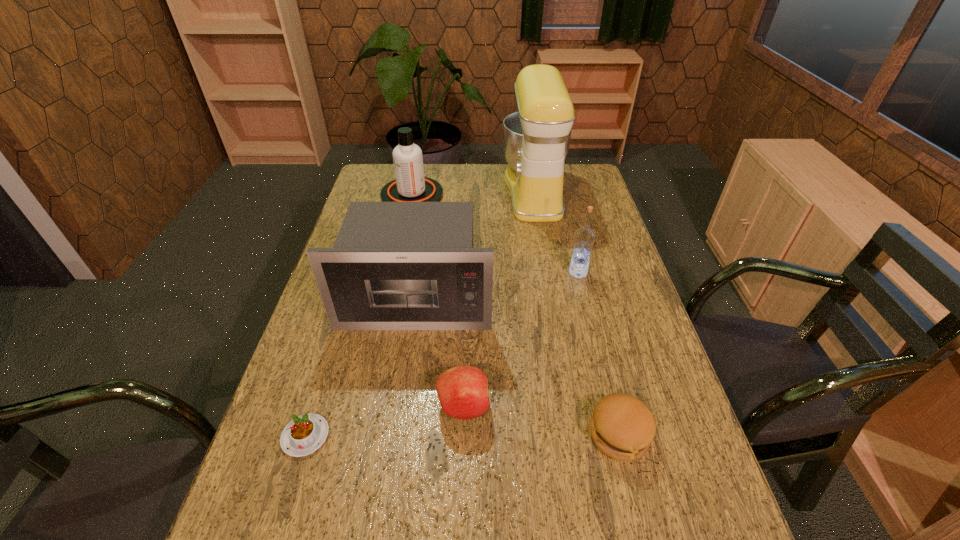
This screenshot has width=960, height=540. I want to click on free space located on the front-facing side of the microwave oven, so click(x=394, y=451).

Find the location of `vacant position located 0.110m on the back of the cleansing agent`. vacant position located 0.110m on the back of the cleansing agent is located at coordinates (419, 166).

Image resolution: width=960 pixels, height=540 pixels. I want to click on vacant position located 0.050m on the front of the vodka, so click(583, 291).

What are the coordinates of `vacant area situated 0.350m on the back of the third shortest object` in the screenshot? It's located at (468, 282).

Find the location of a particular element. vacant space located 0.180m on the back of the hamburger is located at coordinates (596, 344).

Locate an element on the screen. free space located 0.200m on the right of the shortest object is located at coordinates (424, 436).

Locate an element on the screen. The height and width of the screenshot is (540, 960). mixer that is at the far edge is located at coordinates (536, 138).

At what (x,y) coordinates should I click in order to perform the action: click on cleansing agent that is at the far edge. Please return your answer as a coordinate pair (x, y). Looking at the image, I should click on (410, 185).

At what (x,y) coordinates should I click in order to perform the action: click on microwave oven that is at the left edge. Please return your answer as a coordinate pair (x, y). This screenshot has height=540, width=960. Looking at the image, I should click on (394, 265).

What are the coordinates of `cleansing agent that is at the left edge` in the screenshot? It's located at (410, 185).